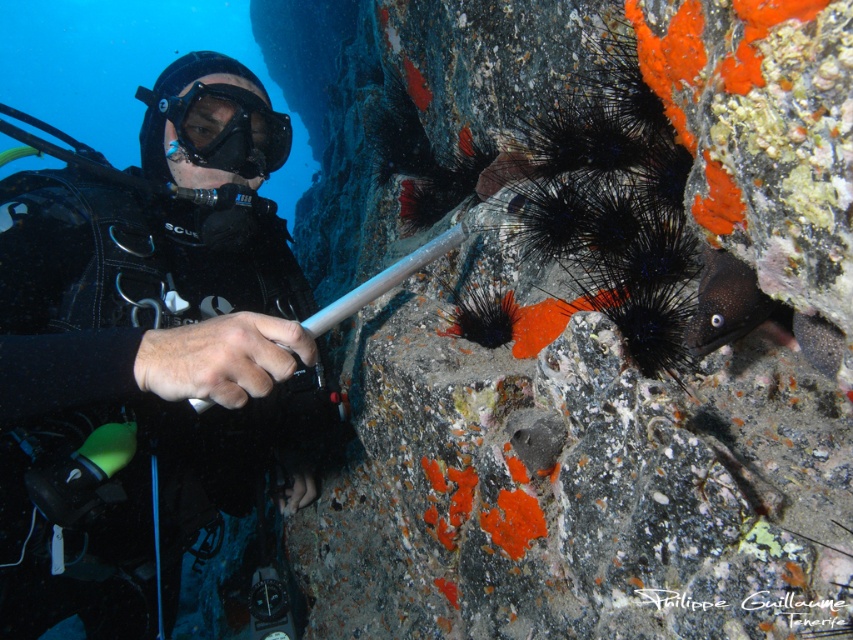
From the picture: Measure the distance between point (256, 456) and camera.

The distance of point (256, 456) from camera is 1.91 meters.

Is black matte diving suit at left bigger than transparent rubber goggles at center?

Correct, black matte diving suit at left is larger in size than transparent rubber goggles at center.

The height and width of the screenshot is (640, 853). What are the coordinates of `black matte diving suit at left` in the screenshot? It's located at (151, 346).

Find the location of a particular element. The width and height of the screenshot is (853, 640). black matte diving suit at left is located at coordinates (151, 346).